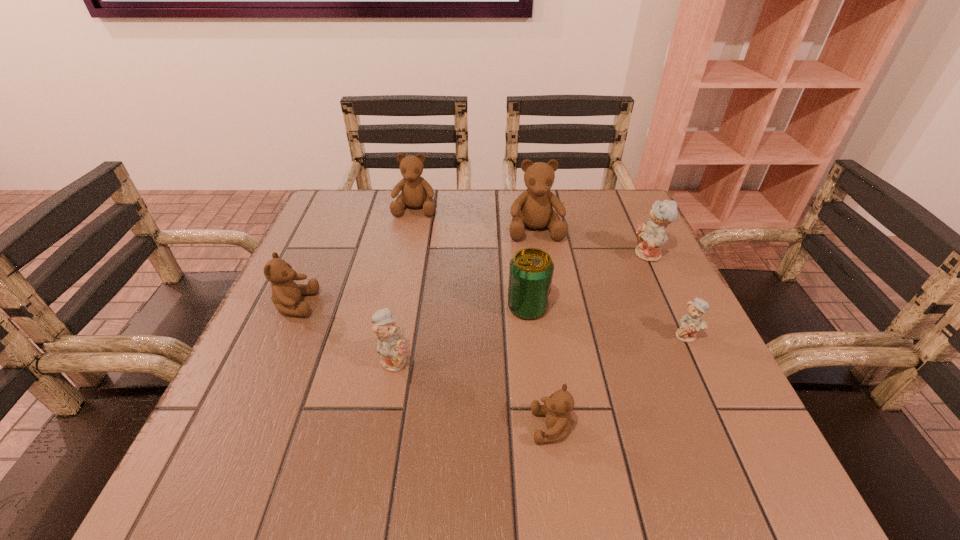
Where is `the closest blue teddy bear to the nearest blue teddy bear`? the closest blue teddy bear to the nearest blue teddy bear is located at coordinates (693, 321).

Point out which blue teddy bear is positioned as the nearest to the biggest blue teddy bear. Please provide its 2D coordinates. Your answer should be formatted as a tuple, i.e. [(x, y)], where the tuple contains the x and y coordinates of a point satisfying the conditions above.

[(693, 321)]

The width and height of the screenshot is (960, 540). In order to click on vacant space that satisfies the following two spatial constraints: 1. on the front-facing side of the tallest object; 2. on the front-facing side of the seventh farthest object in this screenshot , I will do `click(557, 359)`.